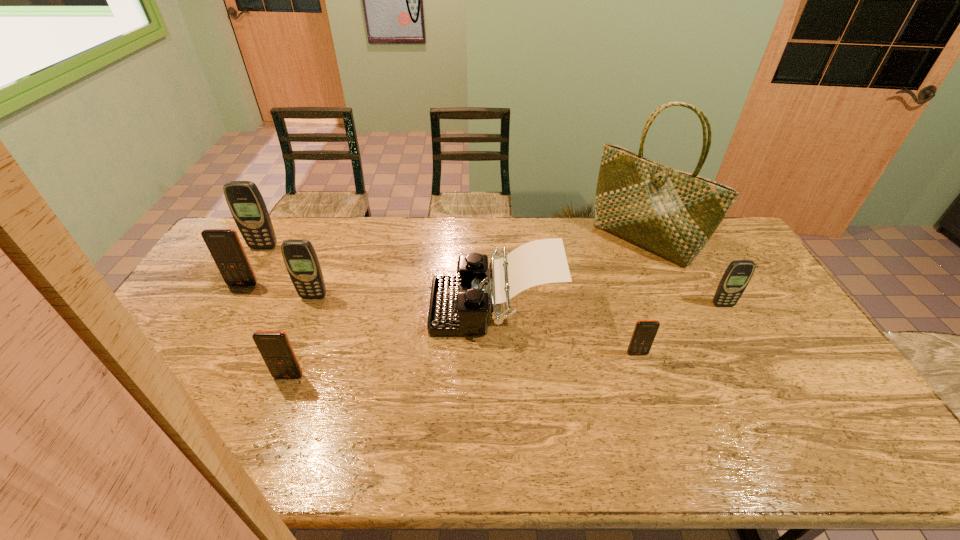
Identify the location of the nearest gray cellular telephone. click(736, 277).

Where is `the second smallest orange cellular telephone`? The height and width of the screenshot is (540, 960). the second smallest orange cellular telephone is located at coordinates (275, 348).

Find the location of a particular element. The image size is (960, 540). the second orange cellular telephone from right to left is located at coordinates (275, 348).

The width and height of the screenshot is (960, 540). Find the location of `the fifth farthest cellular telephone`. the fifth farthest cellular telephone is located at coordinates (644, 333).

Identify the location of the second nearest orange cellular telephone. (644, 333).

Where is `free space located on the left of the tallest object`? Image resolution: width=960 pixels, height=540 pixels. free space located on the left of the tallest object is located at coordinates (518, 241).

Where is `vacant space situated on the screen of the farthest gray cellular telephone`? The height and width of the screenshot is (540, 960). vacant space situated on the screen of the farthest gray cellular telephone is located at coordinates (248, 275).

Where is `vacant area situated on the screen of the leftmost orange cellular telephone`? vacant area situated on the screen of the leftmost orange cellular telephone is located at coordinates (185, 384).

This screenshot has width=960, height=540. I want to click on vacant point located 0.230m on the screen of the second gray cellular telephone from right to left, so click(x=290, y=356).

The height and width of the screenshot is (540, 960). Find the location of `vacant space situated 0.310m on the keys of the typewriter`. vacant space situated 0.310m on the keys of the typewriter is located at coordinates (333, 306).